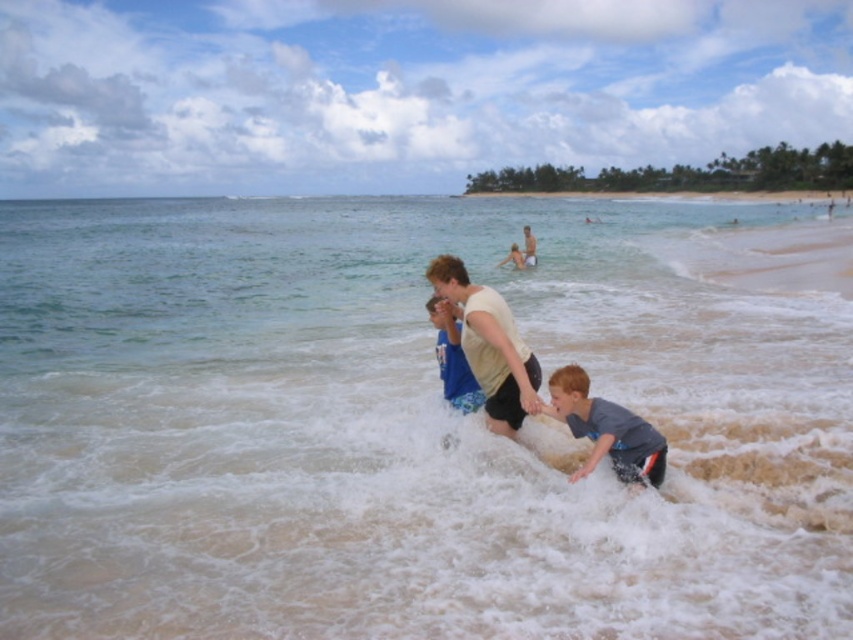
You are a drone operator trying to capture the clearest possible image of the water in this beach scene. The scene includes a point labeled as point (405, 426) which marks clear water at center. Where should you direct your drone to capture the clearest water?

The clearest water is located at the point marked (405, 426), so directing the drone to focus on that point will capture the clearest water at center.